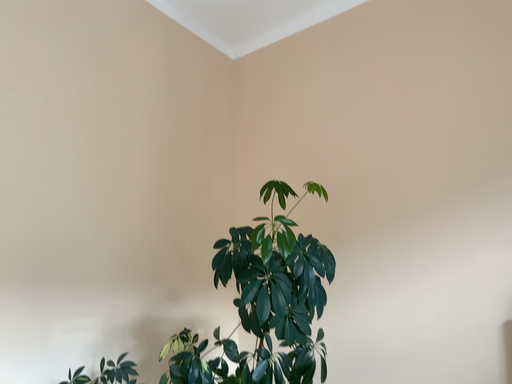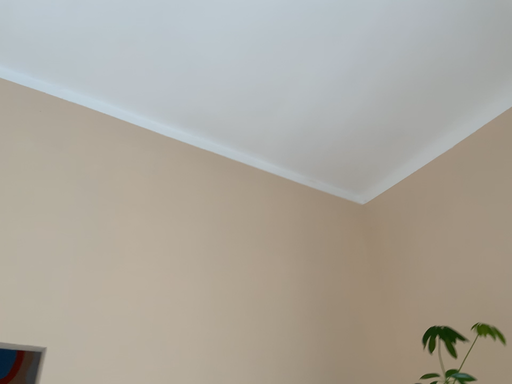
Question: How did the camera likely rotate when shooting the video?

Choices:
 (A) rotated upward
 (B) rotated downward

Answer: (A)